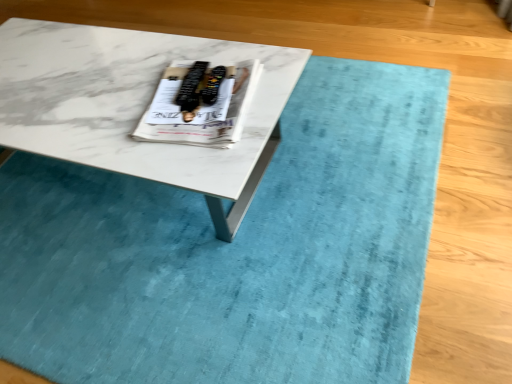
At what (x,y) coordinates should I click in order to perform the action: click on free space below white glossy magazine at center (from a real-world perspective). Please return your answer as a coordinate pair (x, y). This screenshot has height=384, width=512. Looking at the image, I should click on (186, 106).